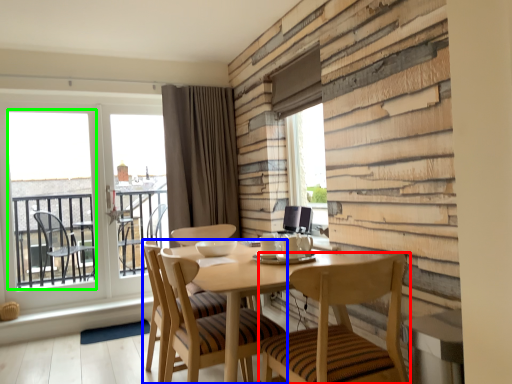
Question: Which object is positioned closest to chair (highlighted by a red box)? Select from chair (highlighted by a blue box) and window screen (highlighted by a green box).

Choices:
 (A) chair
 (B) window screen

Answer: (A)